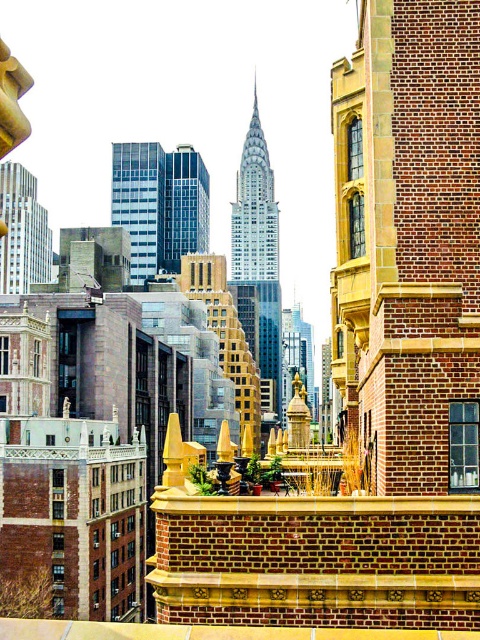
Is shiny glass skyscraper at center bigger than blue glass skyscraper at center?

Indeed, shiny glass skyscraper at center has a larger size compared to blue glass skyscraper at center.

Is point (240, 278) positioned behind point (177, 161)?

Yes, it is.

Where is `shiny glass skyscraper at center`? The image size is (480, 640). shiny glass skyscraper at center is located at coordinates (257, 259).

Which is below, brick ledge at center or glassy blue skyscraper at center?

brick ledge at center is lower down.

Does brick ledge at center have a greater width compared to glassy blue skyscraper at center?

In fact, brick ledge at center might be narrower than glassy blue skyscraper at center.

Does point (396, 513) come behind point (111, 152)?

No, (396, 513) is closer to viewer.

Where is `brick ledge at center`? brick ledge at center is located at coordinates coord(311,504).

Does point (245, 179) lie behind point (143, 212)?

Yes.

Which of these two, shiny glass skyscraper at center or glassy blue skyscraper at center, stands shorter?

Standing shorter between the two is glassy blue skyscraper at center.

Does point (268, 332) come farther from viewer compared to point (140, 208)?

That is True.

Identify the location of shiny glass skyscraper at center. The width and height of the screenshot is (480, 640). (257, 259).